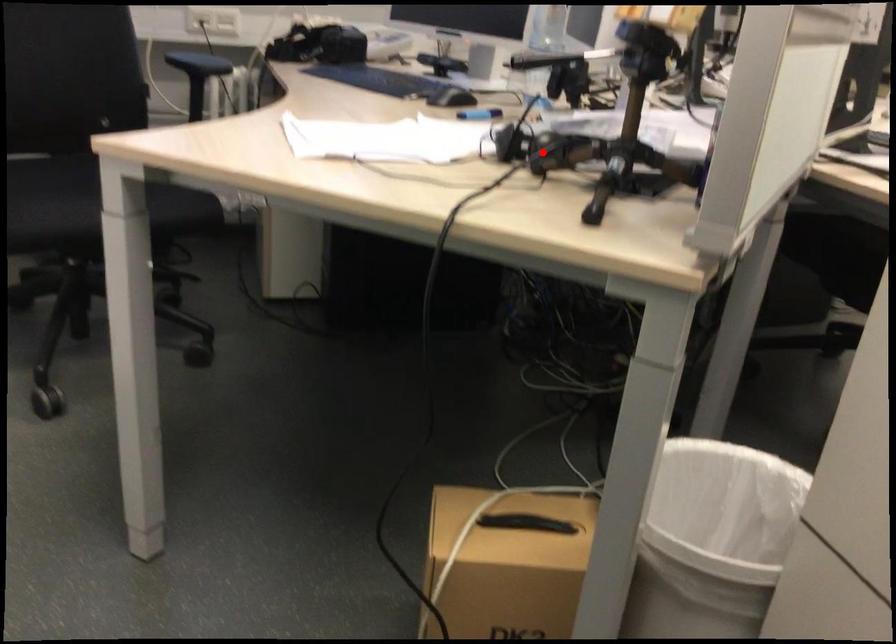
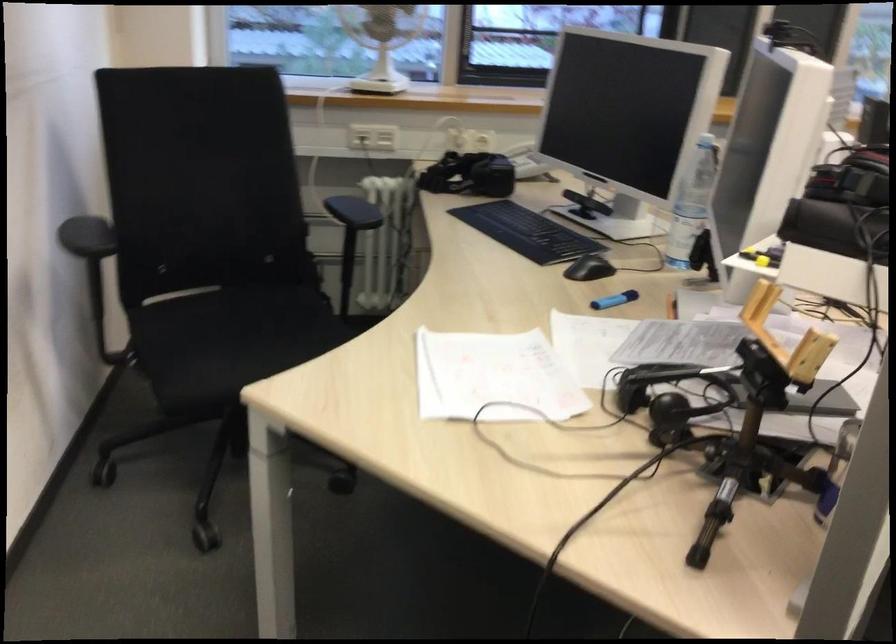
Question: I am providing you with two images of the same scene from different viewpoints. In image1, a red point is highlighted. Considering the same 3D point in image2, which of the following is correct?

Choices:
 (A) It is closer
 (B) It is farther

Answer: (B)